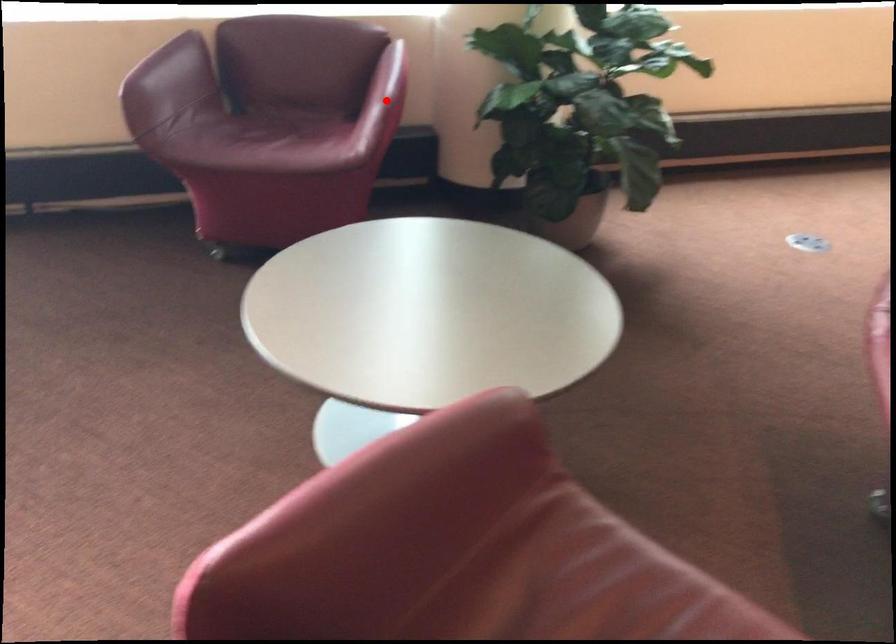
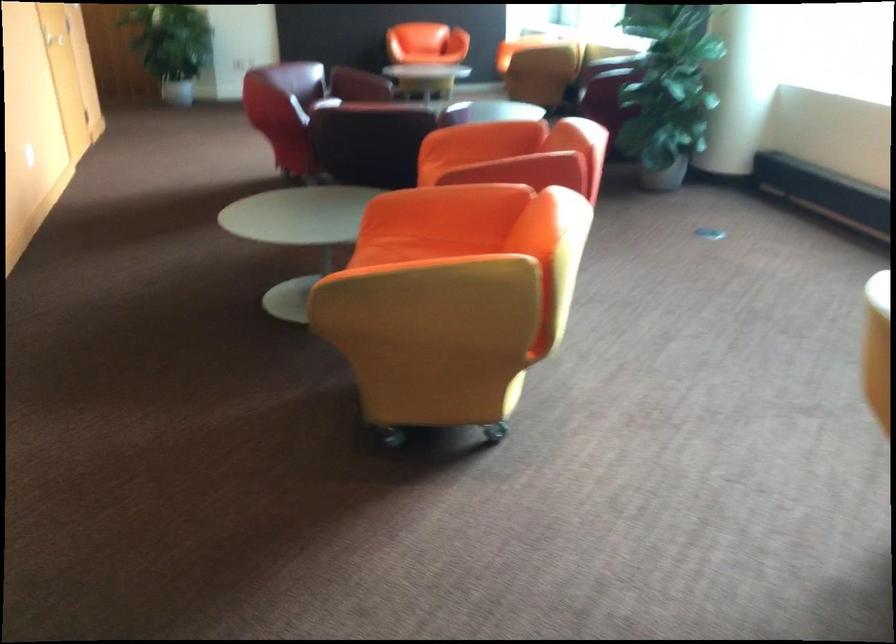
Question: I am providing you with two images of the same scene from different viewpoints. A red point is marked on the first image. Can you still see the location of the red point in image 2?

Choices:
 (A) Yes
 (B) No

Answer: (B)